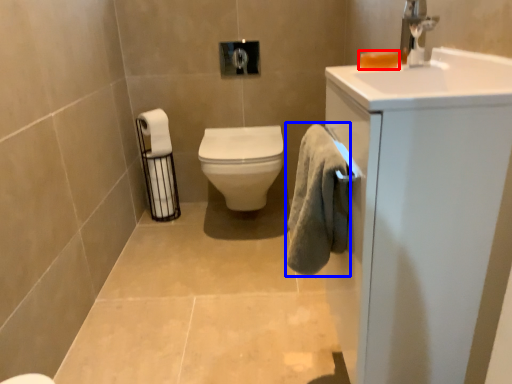
Question: Which point is closer to the camera, soap (highlighted by a red box) or bath towel (highlighted by a blue box)?

Choices:
 (A) soap
 (B) bath towel

Answer: (B)